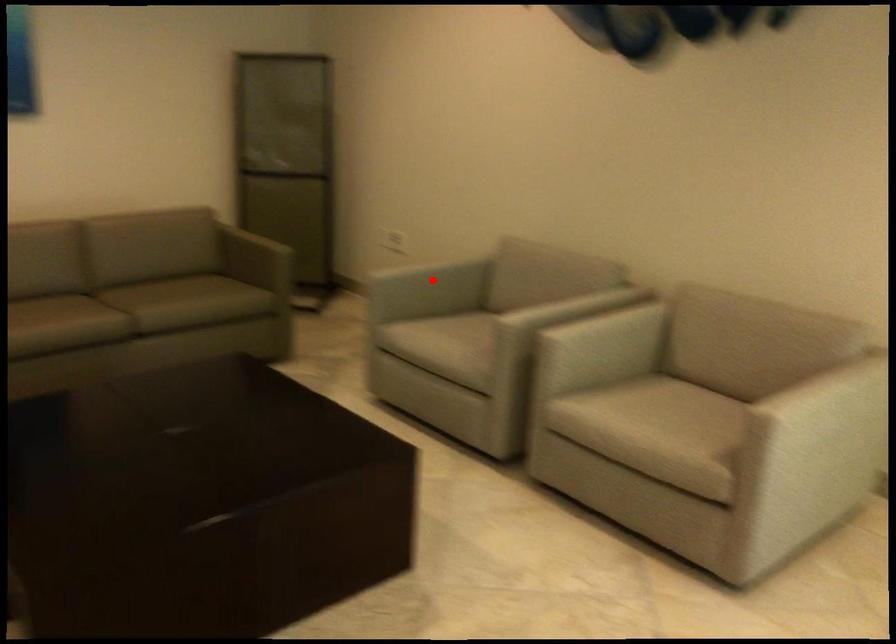
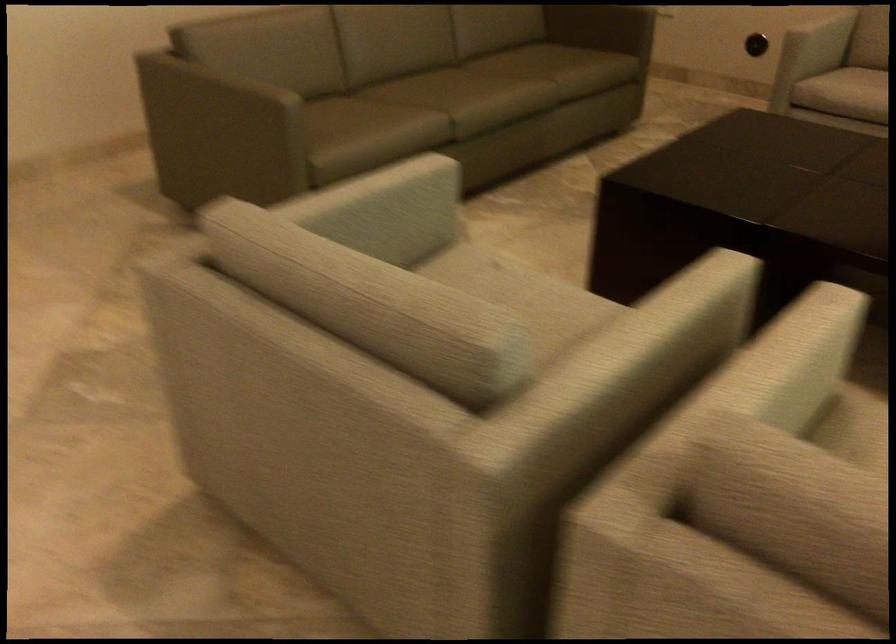
Where in the second image is the point corresponding to the highlighted location from the first image?

(821, 35)